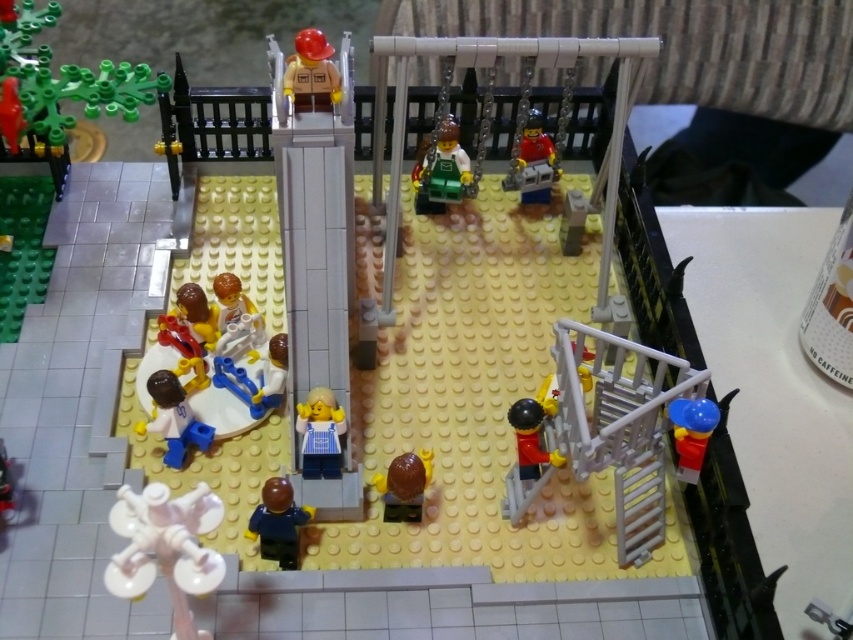
Does white plastic minifigures at center have a greater height compared to bright red plastic minifigure at center-right?

Correct, white plastic minifigures at center is much taller as bright red plastic minifigure at center-right.

Which is in front, point (192, 362) or point (524, 132)?

Point (192, 362)

Between point (213, 374) and point (520, 184), which one is positioned in front?

Point (213, 374) is more forward.

You are a GUI agent. You are given a task and a screenshot of the screen. Output one action in this format:
    pyautogui.click(x=<x>, y=<y>)
    Task: Click on the white plastic minifigures at center
    
    Given the screenshot: What is the action you would take?
    pyautogui.click(x=212, y=362)

Does point (694, 480) come closer to viewer compared to point (270, 406)?

Yes, point (694, 480) is in front of point (270, 406).

Which is more to the right, translucent blue plastic cup at lower right or blue plastic toy at center-left?

From the viewer's perspective, translucent blue plastic cup at lower right appears more on the right side.

Identify the location of translucent blue plastic cup at lower right. (691, 433).

Based on the photo, can you confirm if bright red plastic minifigure at center-right is positioned above brown matte egg at center?

Indeed, bright red plastic minifigure at center-right is positioned over brown matte egg at center.

Is bright red plastic minifigure at center-right positioned behind brown matte egg at center?

Yes, it is behind brown matte egg at center.

This screenshot has height=640, width=853. In order to click on bright red plastic minifigure at center-right in this screenshot , I will do `click(532, 163)`.